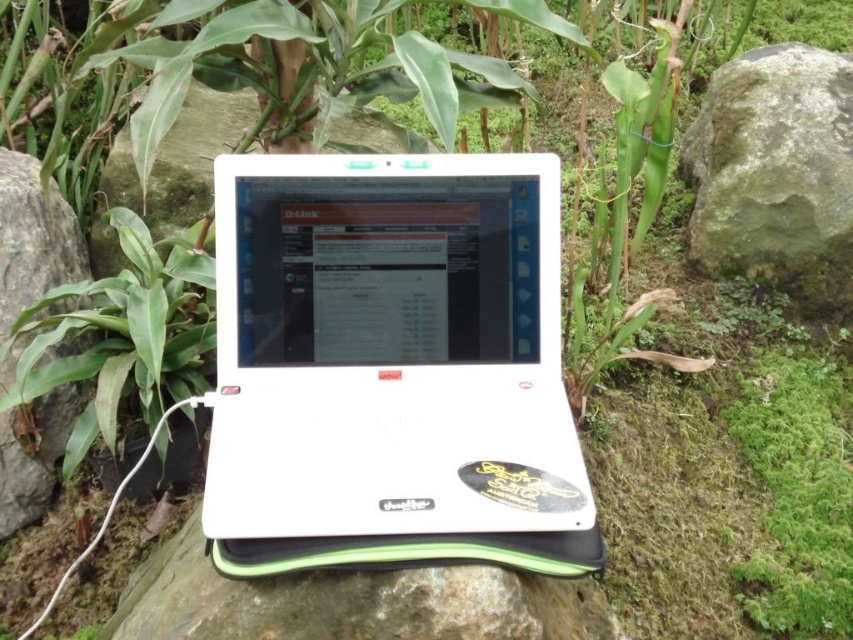
You are a hiker who has just found a white laptop on a rock. You need to move the laptop to a spot where it won not be seen by others passing by. The laptop is currently on the green mossy rock at right. Which object should you move it to so it becomes hidden by the green leafy plant at left?

Move the laptop to the green leafy plant at left. Since the green mossy rock at right is to the right of the green leafy plant at left, moving the laptop to the area near the green leafy plant at left would position it under or behind the plant, hiding it from view.